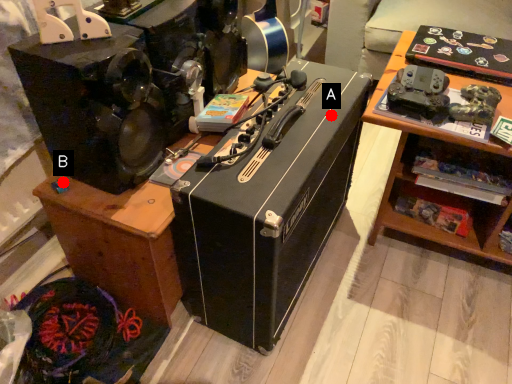
Question: Two points are circled on the image, labeled by A and B beside each circle. Among these points, which one is nearest to the camera?

Choices:
 (A) A is closer
 (B) B is closer

Answer: (B)